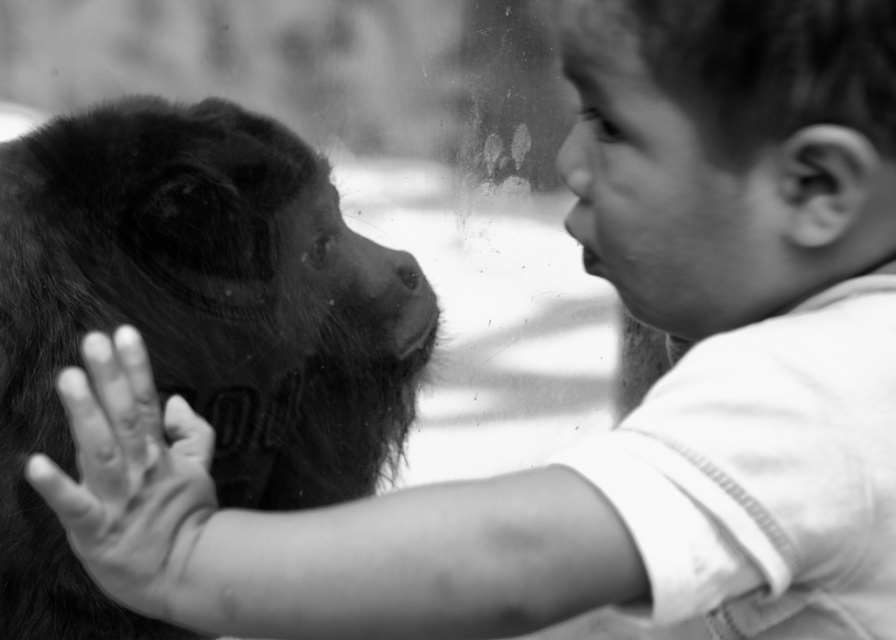
You are a photographer who wants to capture the interaction between the black furry monkey at left and the smooth skin hand at center. Based on their positions, can you tell if the monkey is closer to the camera than the hand?

The black furry monkey at left is positioned over smooth skin hand at center, meaning the monkey is closer to the camera than the hand.

Based on the coordinates provided in the description, where is the black furry monkey at left located in the image?

The black furry monkey at left is located at coordinates point (x=192, y=323).

You are a photographer analyzing this image. You need to determine if the black furry monkey at left can fit entirely within the frame if the smooth skin hand at center is moved to the right. Based on their sizes, what do you conclude?

The black furry monkey at left is larger in width than the smooth skin hand at center. Since the monkey is already positioned at the left and the hand is at the center, moving the hand to the right would free up space on the left side. However, the monkey is wider than the hand, so unless the monkey is moved or the frame size increases, it might not fit entirely within the adjusted space.